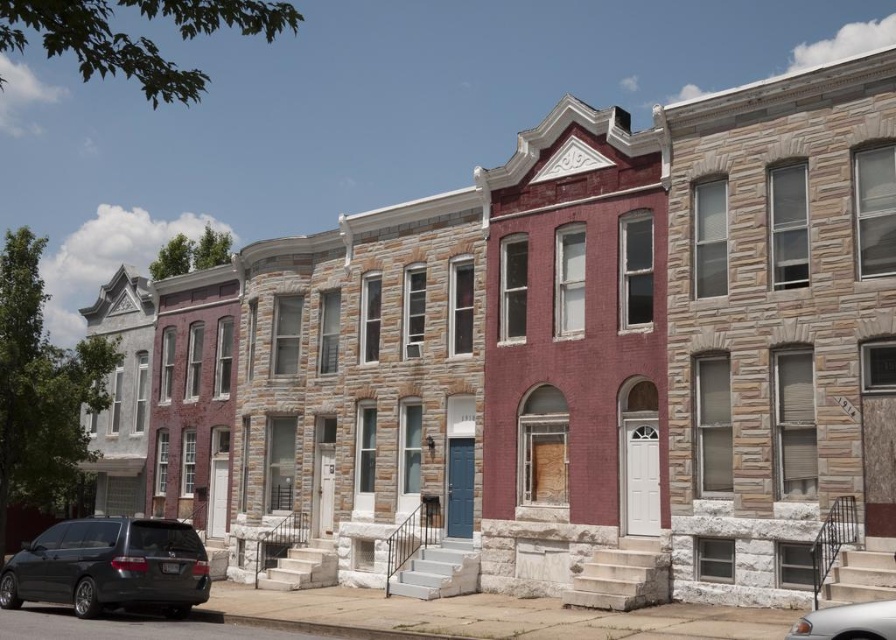
You are a delivery driver trying to park your matte black minivan at lower left in a parking spot located at coordinates 0.886, 0.124. Is your vehicle already in the correct parking spot?

Yes, the matte black minivan at lower left is already positioned at coordinates (x=110, y=566), so it is correctly parked in the designated parking spot.

You are standing at the point labeled point [110,566] in the image. Looking around, you see a matte black minivan at lower left. Which direction should you face to see the closest window with a white frame?

You should face towards the nearest window with a white frame, which is located on the building closest to the matte black minivan at lower left. Since the minivan is at lower left, turning towards the building in that direction will orient you toward the closest white framed window.

You are driving a car and want to park in front of the row of townhouses. You see the matte black minivan at lower left and the silver metallic car at lower right. Which car is blocking your path to the parking spot?

The silver metallic car at lower right is behind the matte black minivan at lower left, so the matte black minivan at lower left is blocking your path to the parking spot.